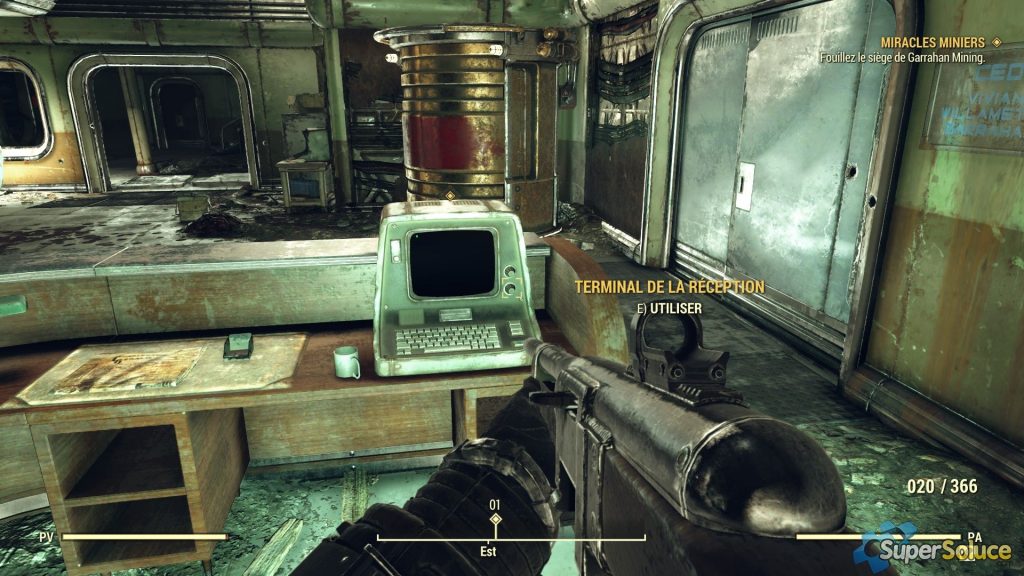
The height and width of the screenshot is (576, 1024). Identify the location of old ratty wooden desk. (255, 397).